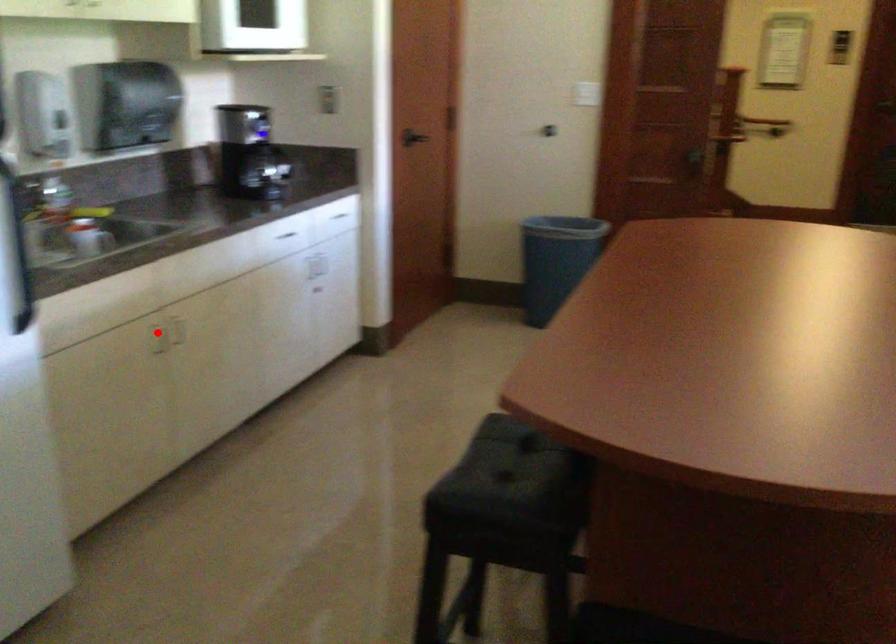
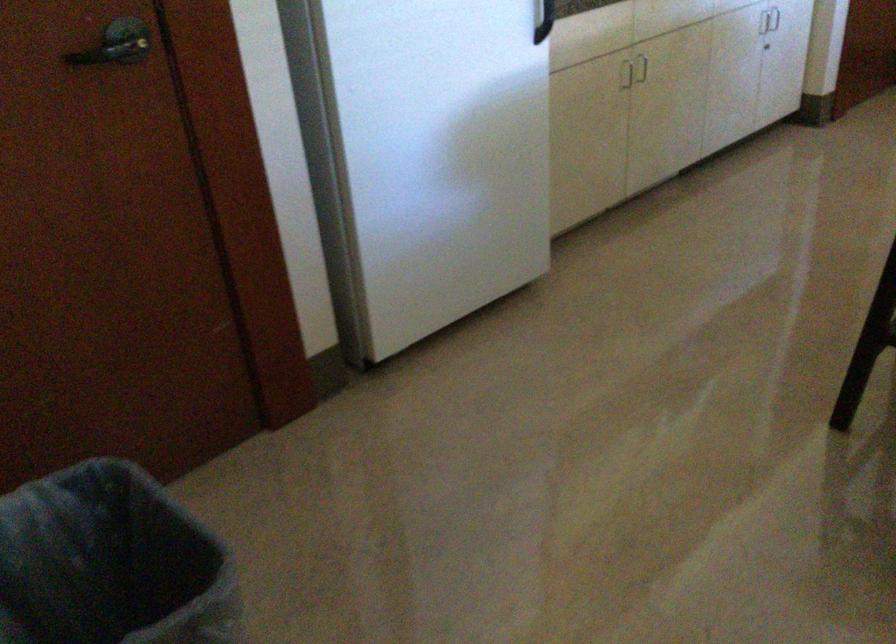
Find the pixel in the second image that matches the highlighted location in the first image.

(642, 69)